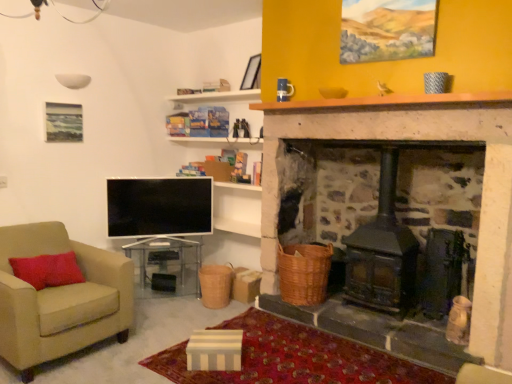
Question: Considering their positions, is braided wicker basket at center, which is counted as the second basket, starting from the right, located in front of or behind brown wooden mantle at upper center?

Choices:
 (A) behind
 (B) front

Answer: (A)

Question: Considering the positions of braided wicker basket at center, which ranks as the 1th basket in left-to-right order, and brown wooden mantle at upper center in the image, is braided wicker basket at center, which ranks as the 1th basket in left-to-right order, bigger or smaller than brown wooden mantle at upper center?

Choices:
 (A) small
 (B) big

Answer: (B)

Question: Which of these objects is positioned farthest from the flat screen tv at lower left?

Choices:
 (A) woven brown basket at lower center, which is the 1th basket in right-to-left order
 (B) matte black picture frame at upper center
 (C) brown wooden mantle at upper center
 (D) clear glass table at center
 (E) braided wicker basket at center, which is counted as the second basket, starting from the right

Answer: (C)

Question: Which object is positioned closest to the clear glass table at center?

Choices:
 (A) beige fabric armchair at left
 (B) flat screen tv at lower left
 (C) woven brown basket at lower center, which is the 1th basket in right-to-left order
 (D) braided wicker basket at center, which ranks as the 1th basket in left-to-right order
 (E) matte black picture frame at upper center

Answer: (B)